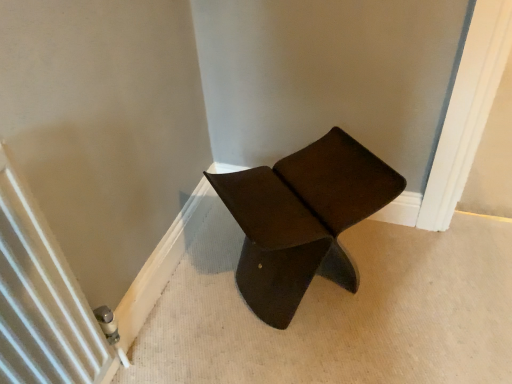
Where is `spots to the right of brown leather stool at center`? spots to the right of brown leather stool at center is located at coordinates (415, 278).